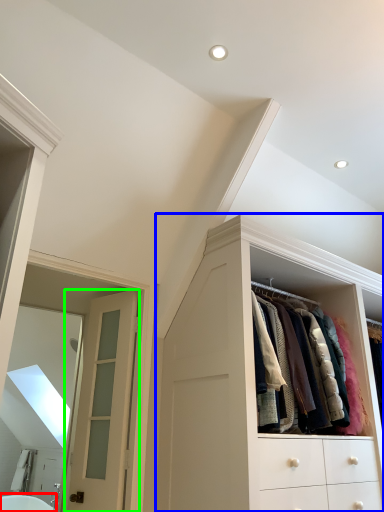
Question: Which object is positioned farthest from bath (highlighted by a red box)? Select from cabinetry (highlighted by a blue box) and door (highlighted by a green box).

Choices:
 (A) cabinetry
 (B) door

Answer: (A)